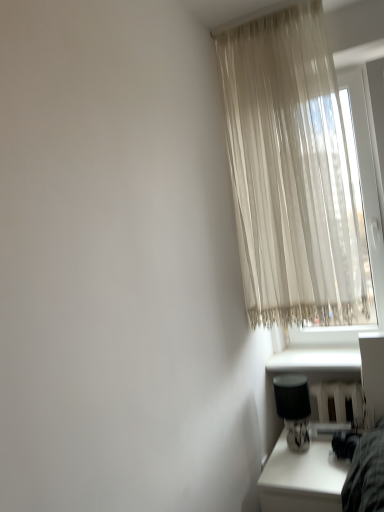
Question: From the image's perspective, is black fabric table lamp at lower right positioned above or below sheer beige curtain at upper right?

Choices:
 (A) below
 (B) above

Answer: (A)

Question: Is black fabric table lamp at lower right inside or outside of sheer beige curtain at upper right?

Choices:
 (A) inside
 (B) outside

Answer: (B)

Question: Based on their relative distances, which object is farther from the black fabric table lamp at lower right?

Choices:
 (A) white smooth window sill at lower right
 (B) white glossy table at lower right
 (C) sheer beige curtain at upper right

Answer: (C)

Question: Which object is positioned closest to the sheer beige curtain at upper right?

Choices:
 (A) black fabric table lamp at lower right
 (B) white smooth window sill at lower right
 (C) white glossy table at lower right

Answer: (B)